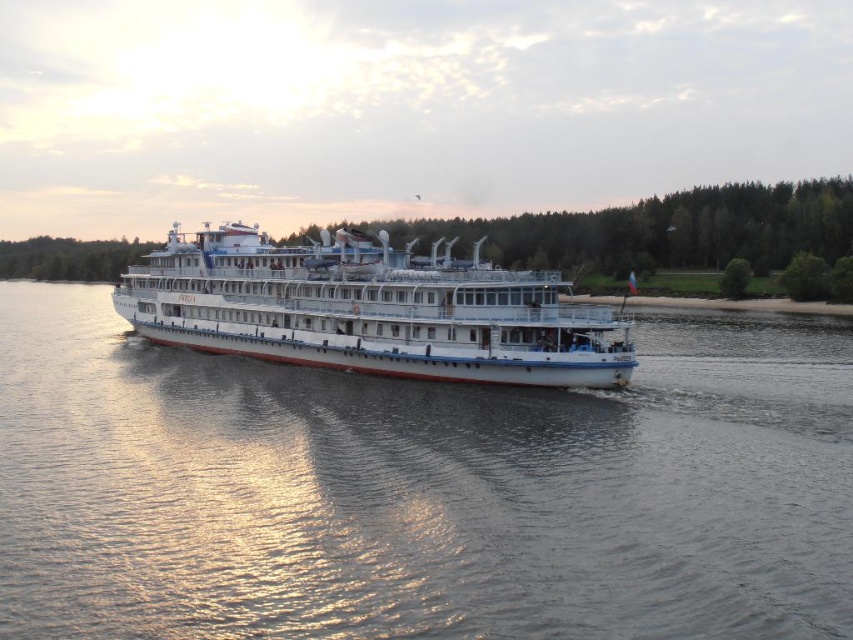
Is white glossy water at center taller than white glossy cruise ship at center?

No, white glossy water at center is not taller than white glossy cruise ship at center.

Does white glossy water at center come in front of white glossy cruise ship at center?

Yes, white glossy water at center is in front of white glossy cruise ship at center.

Between point (581, 602) and point (627, 381), which one is positioned behind?

Point (627, 381)

The width and height of the screenshot is (853, 640). I want to click on white glossy water at center, so click(x=419, y=490).